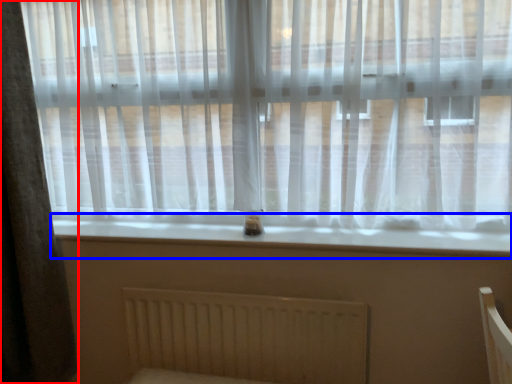
Question: Which of the following is the farthest to the observer, curtain (highlighted by a red box) or window sill (highlighted by a blue box)?

Choices:
 (A) curtain
 (B) window sill

Answer: (B)